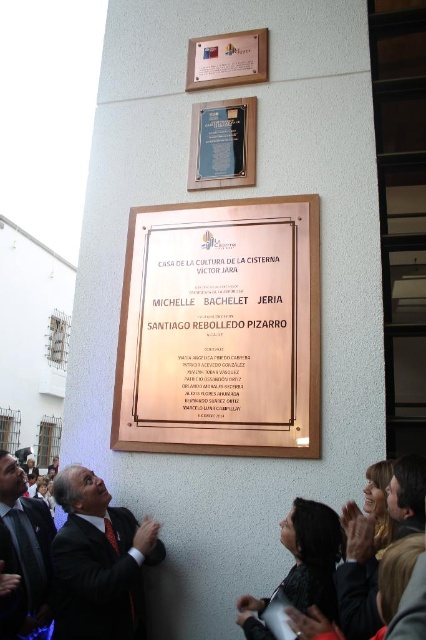
Does bronze plaque at center appear under black polished stone plaque at upper center?

Correct, bronze plaque at center is located below black polished stone plaque at upper center.

Is point (215, 332) behind point (195, 180)?

No, it is not.

Find the location of a particular element. bronze plaque at center is located at coordinates (221, 330).

Between bronze plaque at center and matte black suit at center, which one is positioned lower?

matte black suit at center is lower down.

Does bronze plaque at center lie in front of matte black suit at center?

No, it is not.

Where is `bronze plaque at center`? The image size is (426, 640). bronze plaque at center is located at coordinates point(221,330).

What do you see at coordinates (25, 552) in the screenshot?
I see `dark suit at lower left` at bounding box center [25, 552].

Does point (49, 600) come in front of point (224, 77)?

That is True.

What do you see at coordinates (25, 552) in the screenshot?
I see `dark suit at lower left` at bounding box center [25, 552].

The image size is (426, 640). Identify the location of dark suit at lower left. (25, 552).